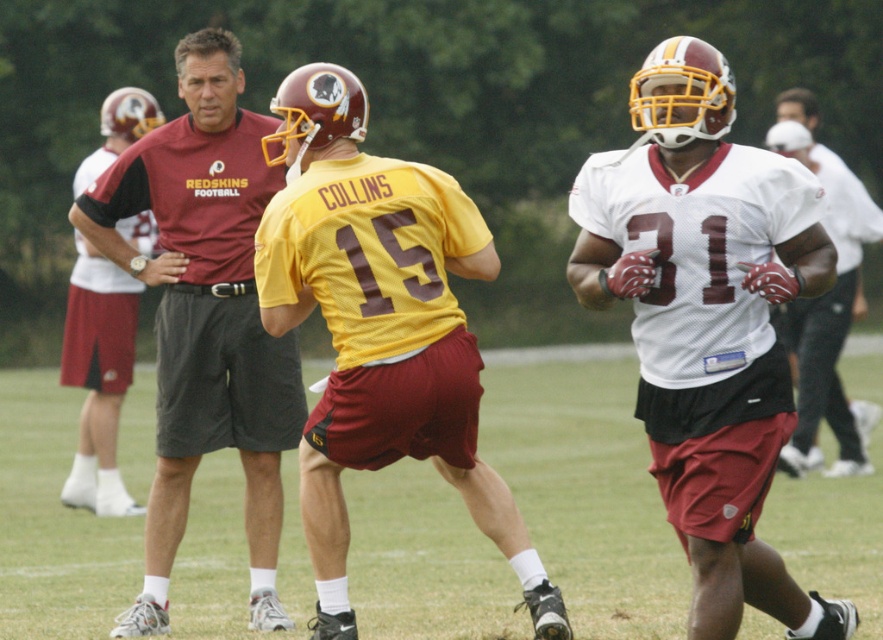
You are a coach observing the football practice. You notice the yellow jersey at center and the white matte jersey at right. Which player has a wider body when viewed from the front?

The yellow jersey at center has a larger width than the white matte jersey at right, so the player wearing the yellow jersey at center has a wider body when viewed from the front.

You are a photographer positioned at the edge of the field. You want to take a photo of the white mesh jersey at center without the green grass at center blocking the view. Is this possible given their positions?

The white mesh jersey at center is behind the green grass at center, so taking a photo without the green grass at center blocking the view would not be possible as the jersey is obscured by the grass.